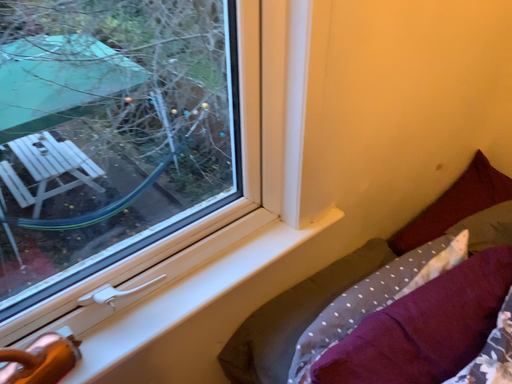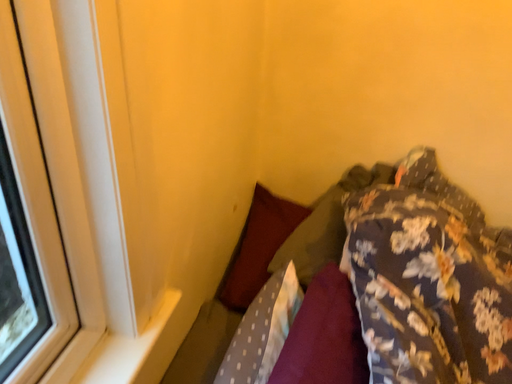
Question: Which way did the camera rotate in the video?

Choices:
 (A) rotated downward
 (B) rotated upward

Answer: (B)